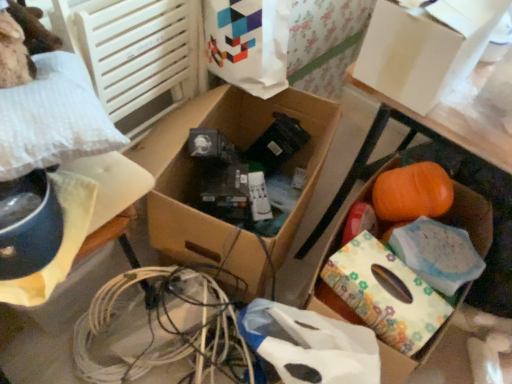
Question: Is white paper bag at upper center surrounding cardboard box at center, positioned as the 3th storage box in right-to-left order?

Choices:
 (A) no
 (B) yes

Answer: (A)

Question: From a real-world perspective, does white paper bag at upper center stand above cardboard box at center, positioned as the 3th storage box in right-to-left order?

Choices:
 (A) yes
 (B) no

Answer: (A)

Question: From the image's perspective, is white paper bag at upper center located beneath cardboard box at center, arranged as the 2th storage box when viewed from the left?

Choices:
 (A) no
 (B) yes

Answer: (A)

Question: From the image's perspective, is white paper bag at upper center located above cardboard box at center, positioned as the 3th storage box in right-to-left order?

Choices:
 (A) no
 (B) yes

Answer: (B)

Question: Considering the relative sizes of white paper bag at upper center and cardboard box at center, arranged as the 2th storage box when viewed from the left, in the image provided, is white paper bag at upper center smaller than cardboard box at center, arranged as the 2th storage box when viewed from the left,?

Choices:
 (A) no
 (B) yes

Answer: (B)

Question: Can you confirm if white paper bag at upper center is positioned to the right of cardboard box at center, arranged as the 2th storage box when viewed from the left?

Choices:
 (A) yes
 (B) no

Answer: (A)

Question: Does white matte wrapping paper at lower center have a greater width compared to cardboard box at center, arranged as the 2th storage box when viewed from the left?

Choices:
 (A) no
 (B) yes

Answer: (A)

Question: From a real-world perspective, is white matte wrapping paper at lower center on top of cardboard box at center, arranged as the 2th storage box when viewed from the left?

Choices:
 (A) no
 (B) yes

Answer: (A)

Question: Is white matte wrapping paper at lower center next to cardboard box at center, positioned as the 3th storage box in right-to-left order, and touching it?

Choices:
 (A) yes
 (B) no

Answer: (B)

Question: Is white matte wrapping paper at lower center facing away from cardboard box at center, positioned as the 3th storage box in right-to-left order?

Choices:
 (A) yes
 (B) no

Answer: (B)

Question: From a real-world perspective, is white matte wrapping paper at lower center physically below cardboard box at center, arranged as the 2th storage box when viewed from the left?

Choices:
 (A) no
 (B) yes

Answer: (B)

Question: Is white matte wrapping paper at lower center surrounding cardboard box at center, arranged as the 2th storage box when viewed from the left?

Choices:
 (A) yes
 (B) no

Answer: (B)

Question: Is white cardboard box at upper right, which appears as the 3th storage box when viewed from the left, to the left of white paper bag at upper center from the viewer's perspective?

Choices:
 (A) yes
 (B) no

Answer: (B)